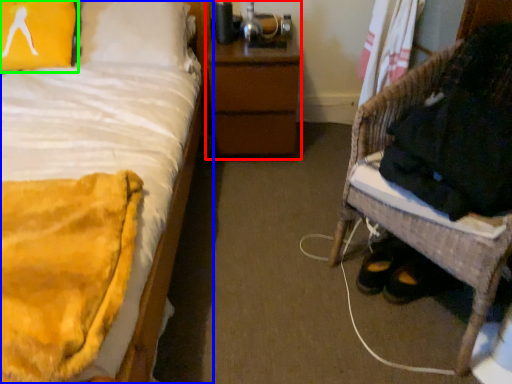
Question: Based on their relative distances, which object is nearer to nightstand (highlighted by a red box)? Choose from bed (highlighted by a blue box) and pillow (highlighted by a green box).

Choices:
 (A) bed
 (B) pillow

Answer: (A)